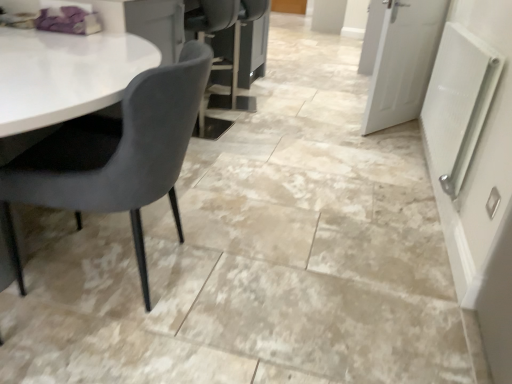
Where is `vacant space underneath velvet grey chair at left (from a real-world perspective)`? This screenshot has width=512, height=384. vacant space underneath velvet grey chair at left (from a real-world perspective) is located at coordinates (123, 269).